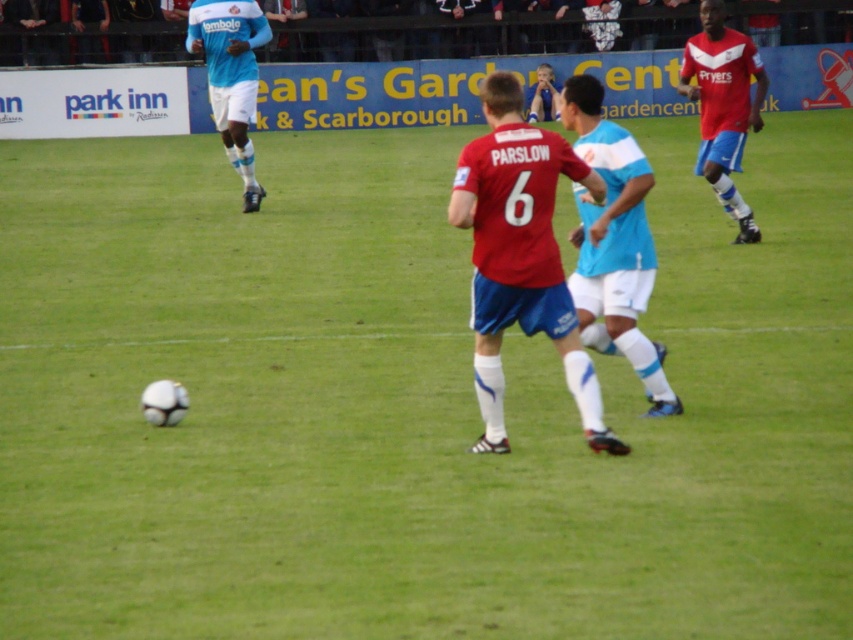
You are a soccer player positioned at the point with coordinates point (647, 374) and want to pass the ball to your teammate located at point (730, 36). Considering the positions of the players in the scene, is there a clear path for the pass?

Point (647, 374) is in front of point (730, 36), so there is a clear path for the pass between the two points as no players are blocking the direct line of sight between them.